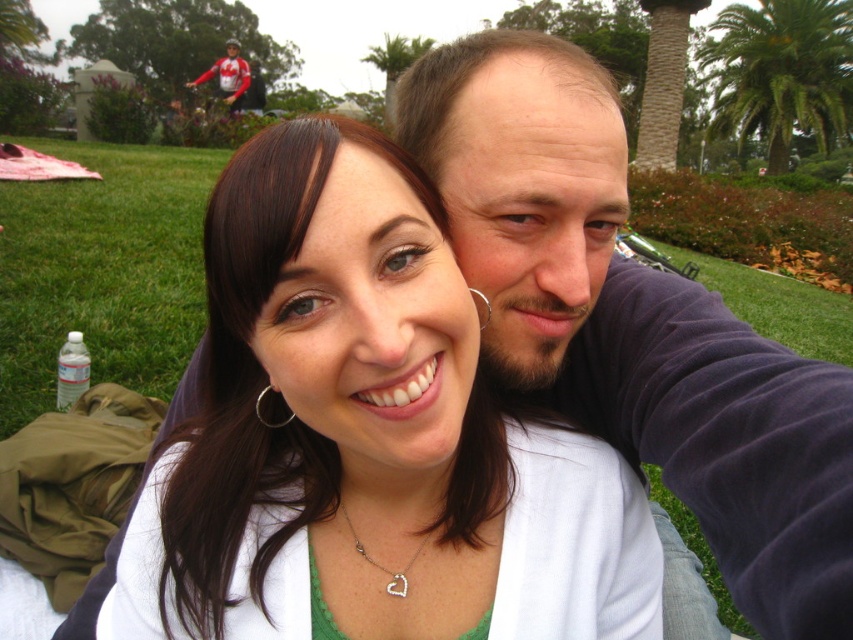
Question: Is green grass at lower left positioned at the back of silver metallic hoop at upper center?

Choices:
 (A) yes
 (B) no

Answer: (A)

Question: Does silver heart-shaped pendant at center have a larger size compared to silver metallic hoop at upper center?

Choices:
 (A) no
 (B) yes

Answer: (B)

Question: Is green leafy palm tree at upper right smaller than silver heart-shaped pendant at center?

Choices:
 (A) no
 (B) yes

Answer: (A)

Question: Which point is farther from the camera taking this photo?

Choices:
 (A) (403, 580)
 (B) (821, 54)

Answer: (B)

Question: Which object appears farthest from the camera in this image?

Choices:
 (A) matte white shirt at center
 (B) green grass at lower left
 (C) dark purple sweater at center
 (D) silver heart-shaped pendant at center

Answer: (B)

Question: Estimate the real-world distances between objects in this image. Which object is farther from the dark purple sweater at center?

Choices:
 (A) silver heart-shaped pendant at center
 (B) green leafy palm tree at upper right
 (C) green grass at lower left
 (D) silver metallic hoop at upper center

Answer: (B)